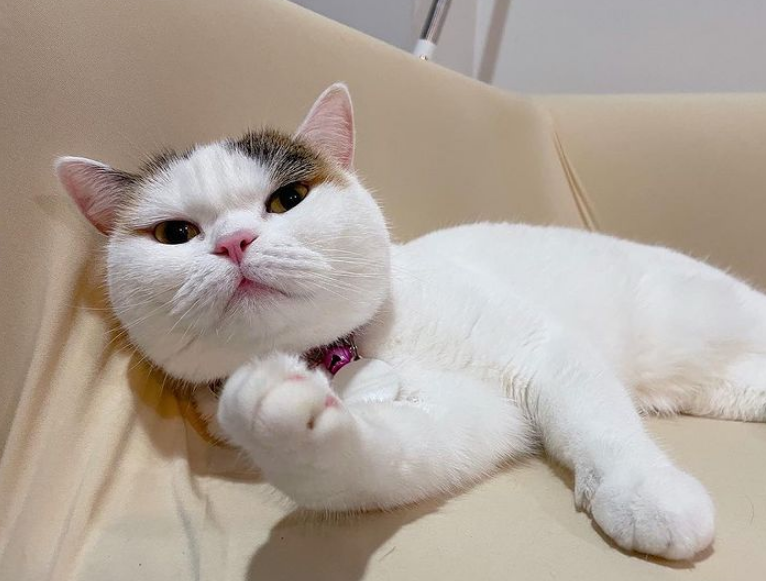
This screenshot has width=766, height=581. I want to click on couch, so click(440, 123), click(210, 100), click(466, 540).